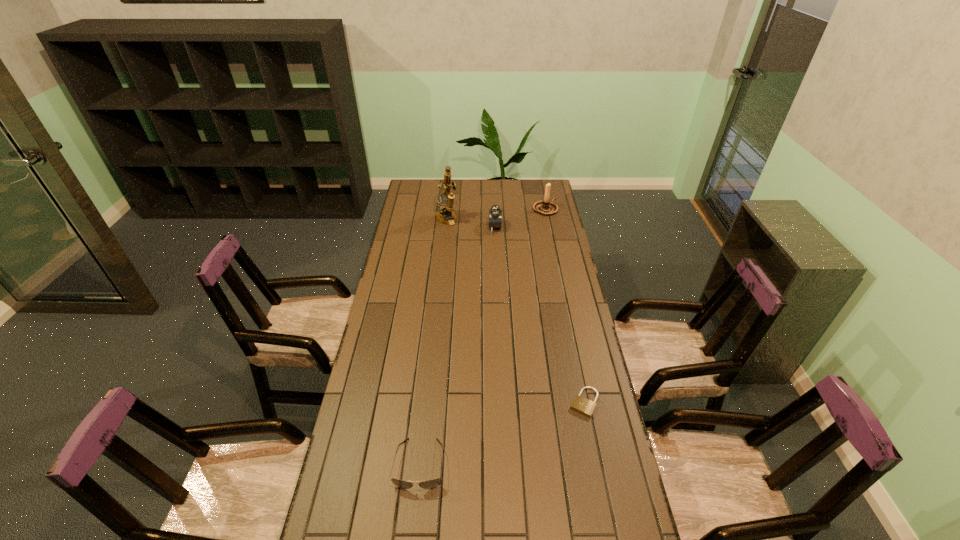
Locate an element on the screen. free point between the nearest object and the third tallest object is located at coordinates (458, 346).

Where is `vacant space in between the alarm clock and the second nearest object`? vacant space in between the alarm clock and the second nearest object is located at coordinates (540, 315).

Select which object appears as the closest to the nearest object. Please provide its 2D coordinates. Your answer should be formatted as a tuple, i.e. [(x, y)], where the tuple contains the x and y coordinates of a point satisfying the conditions above.

[(584, 406)]

Image resolution: width=960 pixels, height=540 pixels. I want to click on object that is the third closest to the third shortest object, so click(x=584, y=406).

The width and height of the screenshot is (960, 540). I want to click on free space that satisfies the following two spatial constraints: 1. on the front side of the alarm clock; 2. on the front-facing side of the fourth tallest object, so [506, 464].

You are a GUI agent. You are given a task and a screenshot of the screen. Output one action in this format:
    pyautogui.click(x=<x>, y=<y>)
    Task: Click on the free space that satisfies the following two spatial constraints: 1. on the front side of the alarm clock; 2. on the front-facing side of the sunglasses
    This screenshot has width=960, height=540.
    Given the screenshot: What is the action you would take?
    pyautogui.click(x=506, y=464)

Locate an element on the screen. This screenshot has height=540, width=960. free space that satisfies the following two spatial constraints: 1. on the back side of the shortest object; 2. on the front side of the alarm clock is located at coordinates (548, 227).

You are a GUI agent. You are given a task and a screenshot of the screen. Output one action in this format:
    pyautogui.click(x=<x>, y=<y>)
    Task: Click on the vacant region that satisfies the following two spatial constraints: 1. on the back side of the candle holder; 2. on the right side of the tallest object
    
    Given the screenshot: What is the action you would take?
    pyautogui.click(x=447, y=209)

Identify the location of vacant position in the image that satisfies the following two spatial constraints: 1. on the front side of the alarm clock; 2. on the right side of the shortest object. The height and width of the screenshot is (540, 960). (503, 402).